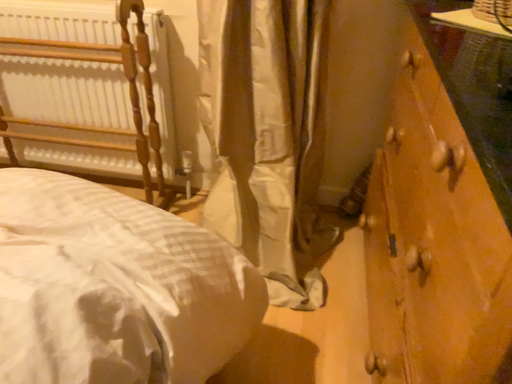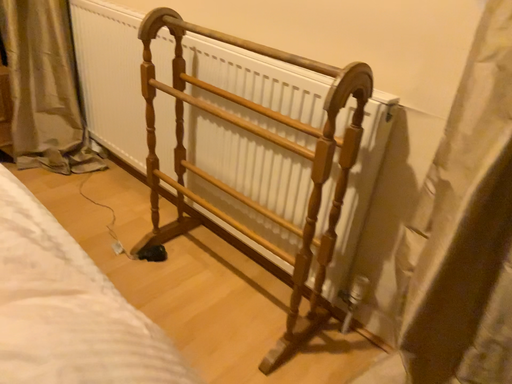
Question: How did the camera likely rotate when shooting the video?

Choices:
 (A) rotated right
 (B) rotated left

Answer: (B)